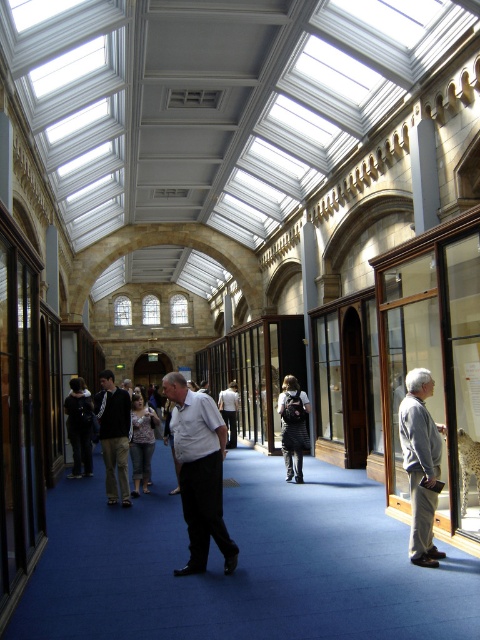
Question: Estimate the real-world distances between objects in this image. Which object is farther from the white shirt at center?

Choices:
 (A) dark gray fabric pants at center
 (B) gray fabric jacket at right

Answer: (A)

Question: Among these objects, which one is nearest to the camera?

Choices:
 (A) gray fabric jacket at right
 (B) striped fabric backpack at center
 (C) dark gray fabric jacket at center
 (D) white shirt at center

Answer: (A)

Question: Is gray fabric jacket at right in front of dark gray fabric jacket at center?

Choices:
 (A) no
 (B) yes

Answer: (B)

Question: Does white shirt at center have a smaller size compared to dark gray fabric jacket at center?

Choices:
 (A) no
 (B) yes

Answer: (B)

Question: Among these points, which one is farthest from the camera?

Choices:
 (A) (207, 420)
 (B) (416, 493)
 (C) (299, 483)
 (D) (72, 428)

Answer: (D)

Question: Is gray fabric jacket at right thinner than dark gray fabric jacket at center?

Choices:
 (A) no
 (B) yes

Answer: (B)